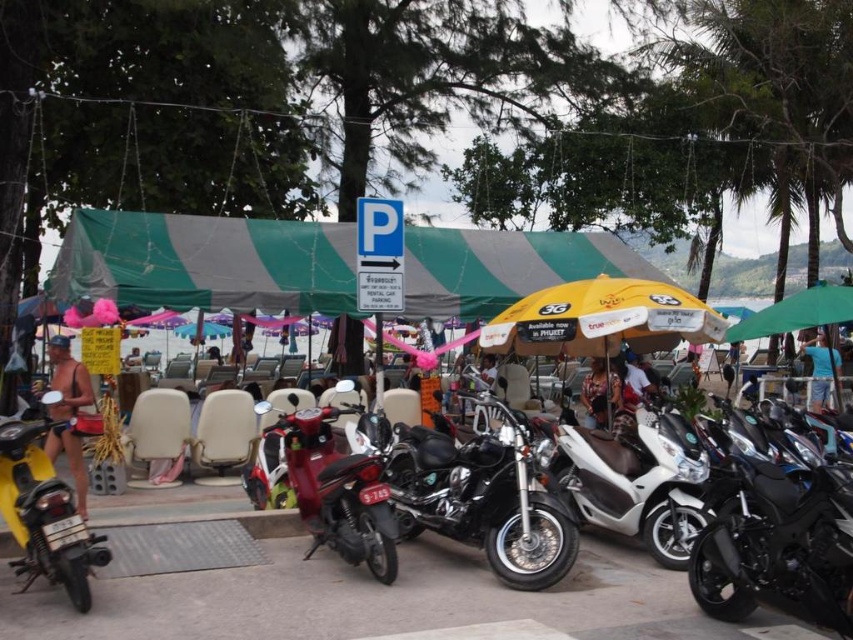
Question: Which of the following is the closest to the observer?

Choices:
 (A) yellow matte motorcycle at left
 (B) white matte scooter at center
 (C) blue fabric umbrella at upper right
 (D) green fabric canopy at center

Answer: (A)

Question: Is shiny chrome motorcycle at center further to camera compared to white matte scooter at center?

Choices:
 (A) no
 (B) yes

Answer: (A)

Question: Considering the relative positions of shiny red motorcycle at center and green fabric umbrella at center-right in the image provided, where is shiny red motorcycle at center located with respect to green fabric umbrella at center-right?

Choices:
 (A) below
 (B) above

Answer: (A)

Question: Which point is closer to the camera taking this photo?

Choices:
 (A) (820, 378)
 (B) (196, 234)
 (C) (648, 506)

Answer: (C)

Question: Does shiny chrome motorcycle at center appear on the left side of leather jacket at center?

Choices:
 (A) yes
 (B) no

Answer: (A)

Question: Which point is closer to the camera?

Choices:
 (A) white matte scooter at center
 (B) yellow fabric umbrella at center
 (C) yellow matte motorcycle at left
 (D) green fabric umbrella at center-right

Answer: (C)